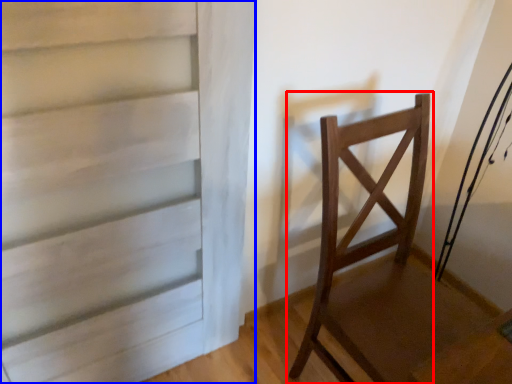
Question: Which point is further to the camera, chair (highlighted by a red box) or door (highlighted by a blue box)?

Choices:
 (A) chair
 (B) door

Answer: (A)